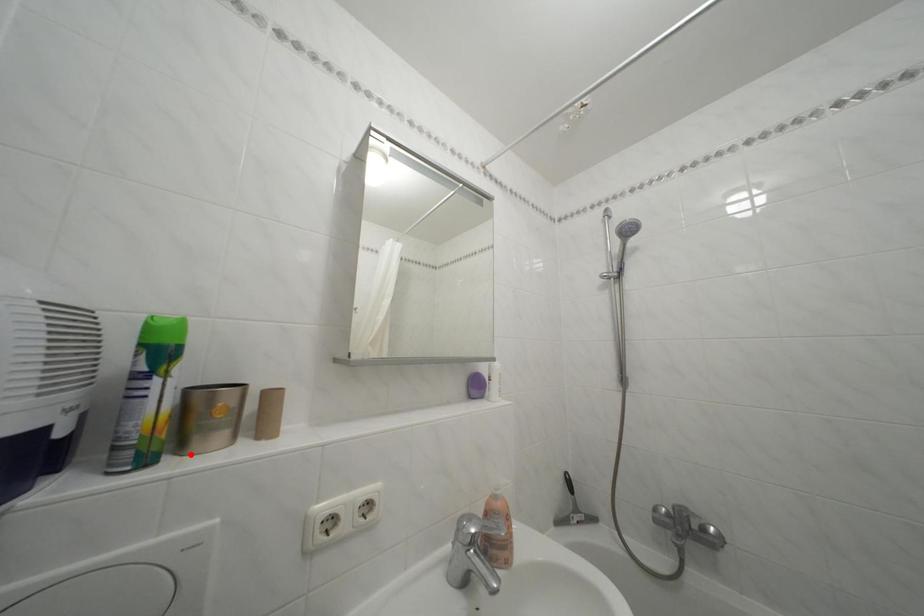
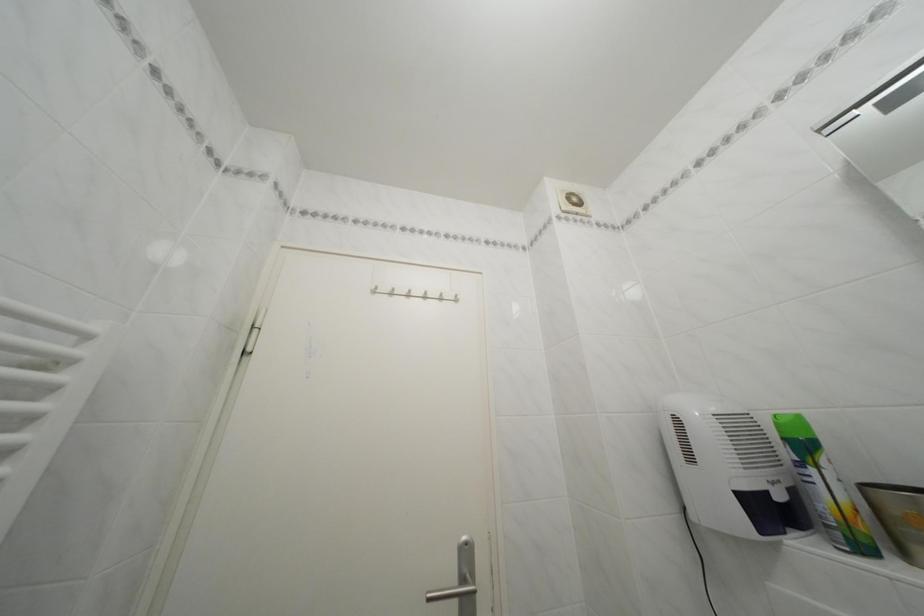
Question: I am providing you with two images of the same scene from different viewpoints. Image1 has a red point marked. In image2, the corresponding 3D location appears at what relative position? Reply with the corresponding letter.

Choices:
 (A) Closer
 (B) Farther

Answer: (A)